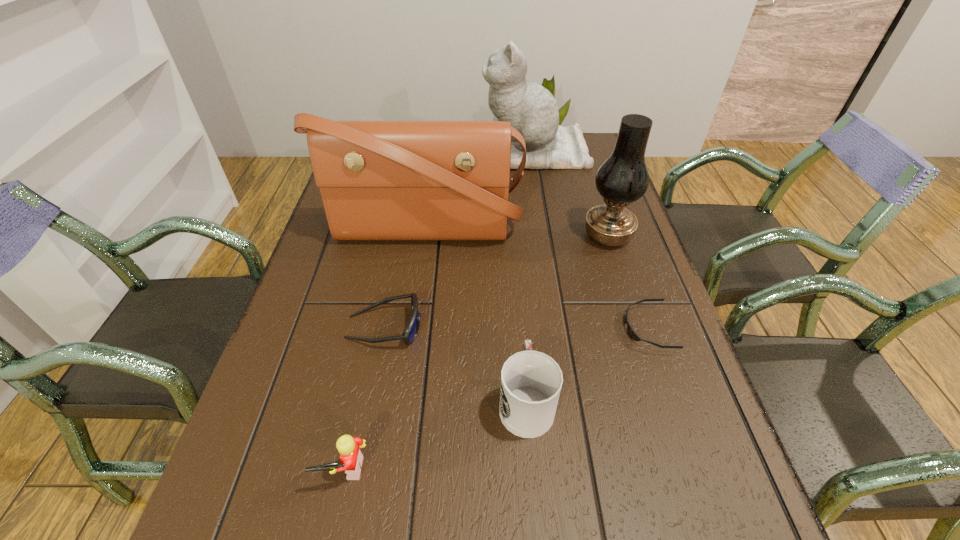
Where is `cat`? cat is located at coordinates (531, 109).

This screenshot has width=960, height=540. I want to click on satchel, so click(379, 180).

Locate an element on the screen. oil lamp is located at coordinates (623, 178).

The image size is (960, 540). I want to click on the sixth farthest object, so click(531, 381).

I want to click on the fifth tallest object, so click(351, 458).

At what (x,y) coordinates should I click in order to perform the action: click on Lego. Please return your answer as a coordinate pair (x, y). Image resolution: width=960 pixels, height=540 pixels. Looking at the image, I should click on (351, 458).

Image resolution: width=960 pixels, height=540 pixels. In order to click on the second shortest object in this screenshot , I will do `click(412, 329)`.

Identify the location of the taller sunglasses. (412, 329).

Locate an element on the screen. Image resolution: width=960 pixels, height=540 pixels. the right sunglasses is located at coordinates coord(630,331).

Locate an element on the screen. the shorter sunglasses is located at coordinates (630, 331).